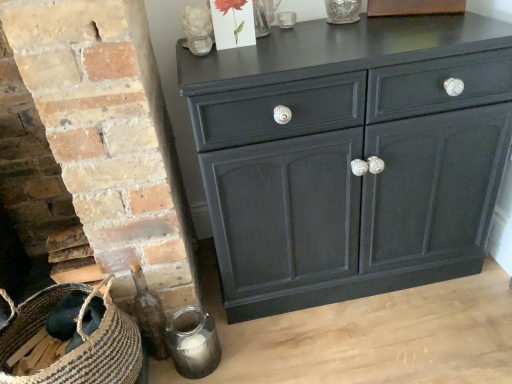
Question: In the image, is translucent glass flower at upper center, which is the 2th flower from right to left, on the left side or the right side of brown woven basket at lower left?

Choices:
 (A) right
 (B) left

Answer: (A)

Question: From a real-world perspective, is translucent glass flower at upper center, which is the 2th flower from right to left, positioned above or below brown woven basket at lower left?

Choices:
 (A) above
 (B) below

Answer: (A)

Question: Which of these objects is positioned farthest from the matte black cabinet at center?

Choices:
 (A) transparent glass vase at upper center
 (B) brown woven basket at lower left
 (C) matte paper card at upper center, the first flower from the right
 (D) translucent glass flower at upper center, which is the first flower from left to right

Answer: (D)

Question: Which object is the farthest from the brown woven basket at lower left?

Choices:
 (A) matte paper card at upper center, which is the 2th flower in left-to-right order
 (B) matte black cabinet at center
 (C) translucent glass flower at upper center, which is the first flower from left to right
 (D) transparent glass vase at upper center

Answer: (D)